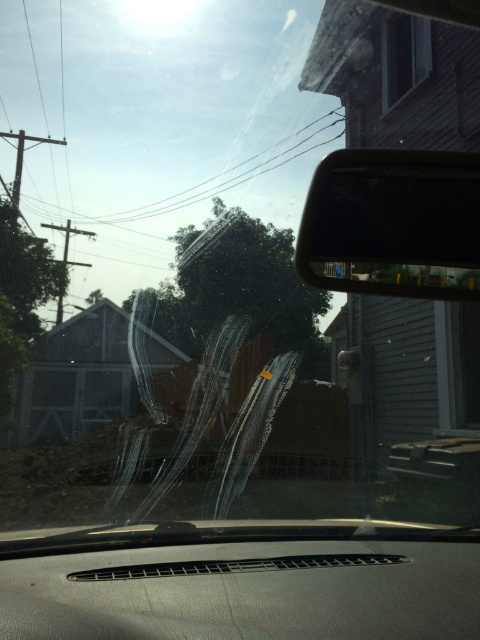
You are driving and need to check your blind spot. The matte gray dashboard at center and the black glossy view mirror at upper right are in your line of sight. Which object is closer to the windshield?

The matte gray dashboard at center is below the black glossy view mirror at upper right, so the dashboard is closer to the windshield than the view mirror.

You are sitting in the driver seat of the vehicle and looking through the windshield. You see two points marked on the windshield at coordinates point (0, 589) and point (437, 188). Which point is closer to your eyes?

Point (0, 589) is closer to the camera than point (437, 188), so the point (0, 589) is closer to your eyes.

You are a delivery driver who needs to place a 2.5 meter long box between the matte gray dashboard at center and the black glossy view mirror at upper right. Can you fit the box horizontally between them?

The distance between the matte gray dashboard at center and the black glossy view mirror at upper right is 2.33 meters. Since the box is 2.5 meters long, which is longer than the available space, it cannot be placed horizontally between them.